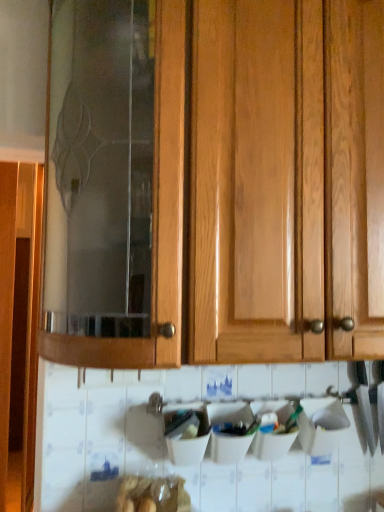
Question: Is translucent plastic bag at lower center taller or shorter than wooden cabinet at center?

Choices:
 (A) tall
 (B) short

Answer: (B)

Question: Considering the positions of translucent plastic bag at lower center and wooden cabinet at center in the image, is translucent plastic bag at lower center bigger or smaller than wooden cabinet at center?

Choices:
 (A) big
 (B) small

Answer: (B)

Question: Considering the relative positions of translucent plastic bag at lower center and wooden cabinet at center in the image provided, is translucent plastic bag at lower center to the left or to the right of wooden cabinet at center?

Choices:
 (A) left
 (B) right

Answer: (A)

Question: From the image's perspective, is wooden cabinet at center above or below translucent plastic bag at lower center?

Choices:
 (A) above
 (B) below

Answer: (A)

Question: In terms of height, does wooden cabinet at center look taller or shorter compared to translucent plastic bag at lower center?

Choices:
 (A) short
 (B) tall

Answer: (B)

Question: In terms of size, does wooden cabinet at center appear bigger or smaller than translucent plastic bag at lower center?

Choices:
 (A) small
 (B) big

Answer: (B)

Question: Which is correct: wooden cabinet at center is inside translucent plastic bag at lower center, or outside of it?

Choices:
 (A) inside
 (B) outside

Answer: (B)